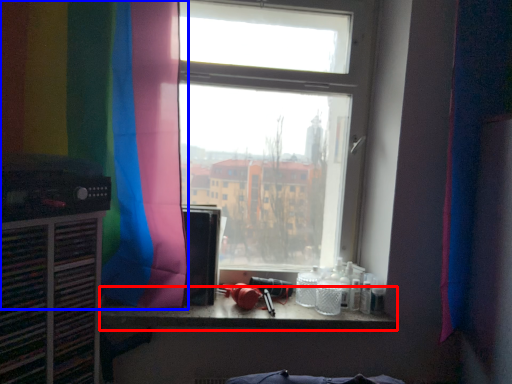
Question: Which object is further to the camera taking this photo, counter top (highlighted by a red box) or curtain (highlighted by a blue box)?

Choices:
 (A) counter top
 (B) curtain

Answer: (A)